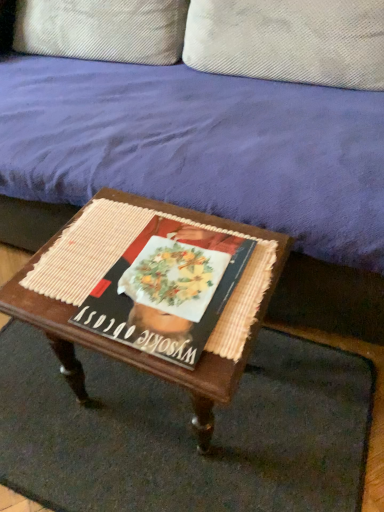
You are a GUI agent. You are given a task and a screenshot of the screen. Output one action in this format:
    pyautogui.click(x=<x>, y=<y>)
    Task: Click on the blank space situated above woven mat at center (from a real-world perspective)
    The height and width of the screenshot is (512, 384).
    Given the screenshot: What is the action you would take?
    pyautogui.click(x=160, y=423)